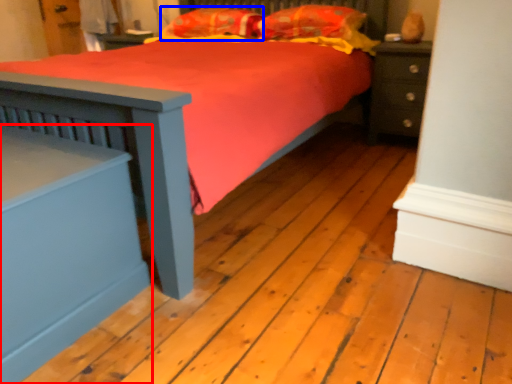
Question: Which of the following is the farthest to the observer, nightstand (highlighted by a red box) or pillow (highlighted by a blue box)?

Choices:
 (A) nightstand
 (B) pillow

Answer: (B)